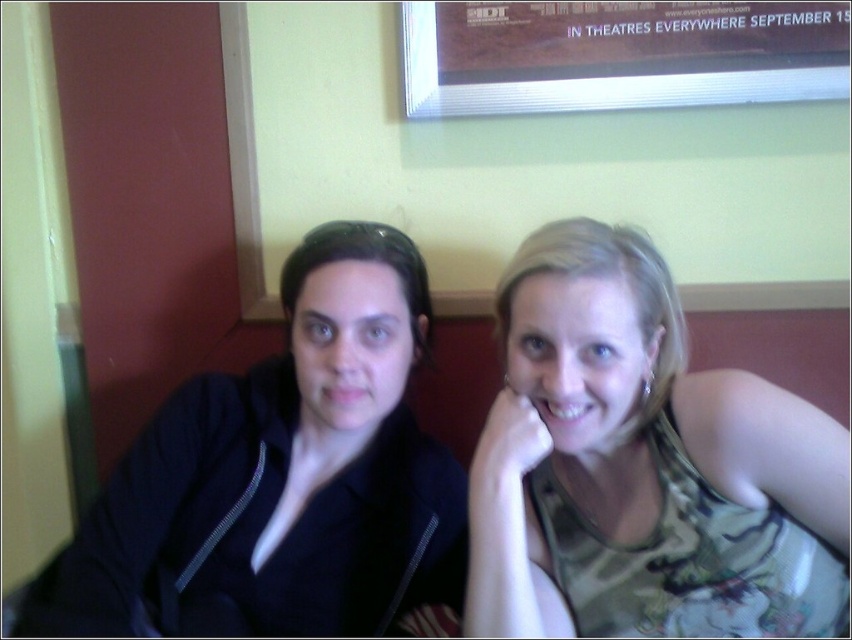
You are trying to locate the camouflage tank top at center in the image. What are the coordinates where it is positioned?

The camouflage tank top at center is located at coordinates point (642, 465).

You are a dental professional examining a patient. The patient has a matte black mouth at center and white glossy teeth at center. Based on the image, which object is wider?

The matte black mouth at center is wider than the white glossy teeth at center.

You are a photographer taking a portrait of the two people in the image. You want to ensure that both the camouflage tank top at center and the matte black mouth at center are clearly visible in the photo. Considering their sizes, which object should you focus on to ensure both are in focus?

The camouflage tank top at center is taller than the matte black mouth at center, so focusing on the camouflage tank top at center will help ensure both are in focus since it is larger and occupies more space in the frame.